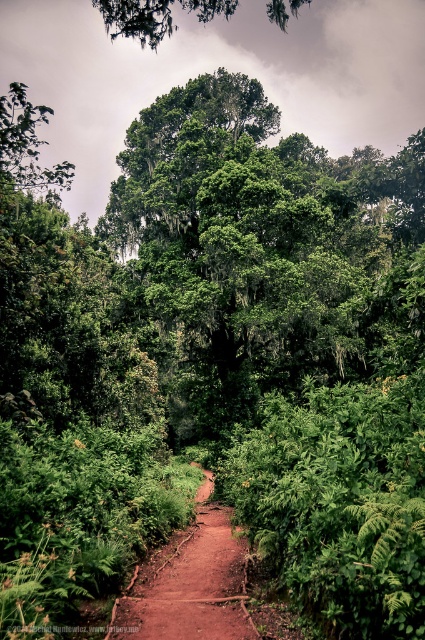
Is point (243, 556) less distant than point (283, 13)?

No, (243, 556) is further to viewer.

Between point (166, 557) and point (155, 1), which one is positioned behind?

Point (166, 557)

The height and width of the screenshot is (640, 425). I want to click on brown dirt track at center, so click(189, 582).